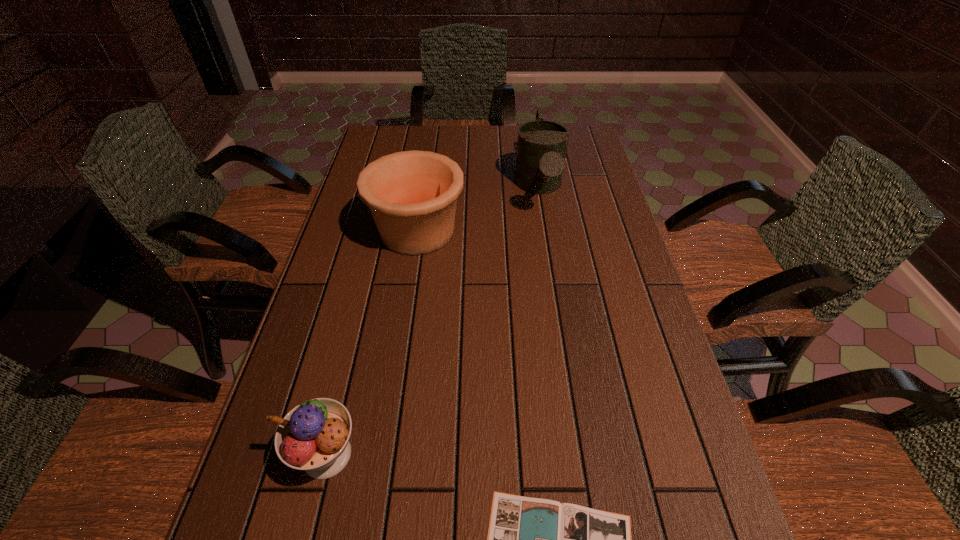
Locate an element on the screen. This screenshot has height=540, width=960. object present at the far right corner is located at coordinates (541, 147).

Locate an element on the screen. blank space at the far edge is located at coordinates (441, 137).

Where is `vacant area at the left edge`? The width and height of the screenshot is (960, 540). vacant area at the left edge is located at coordinates (362, 164).

The height and width of the screenshot is (540, 960). What are the coordinates of `free space at the right edge` in the screenshot? It's located at (596, 252).

The image size is (960, 540). In order to click on free space between the tallest object and the third farthest object in this screenshot , I will do `click(433, 321)`.

Where is `free spot between the tallest object and the third farthest object`? free spot between the tallest object and the third farthest object is located at coordinates [x=433, y=321].

Find the location of a particular element. This screenshot has width=960, height=540. empty location between the third farthest object and the pottery is located at coordinates (372, 343).

At what (x,y) coordinates should I click in order to perform the action: click on free space between the pottery and the icecream. Please return your answer as a coordinate pair (x, y). The height and width of the screenshot is (540, 960). Looking at the image, I should click on (372, 343).

The image size is (960, 540). In order to click on the second closest object to the pottery in this screenshot , I will do `click(314, 436)`.

Image resolution: width=960 pixels, height=540 pixels. What are the coordinates of `object that stands as the second closest to the pottery` in the screenshot? It's located at (314, 436).